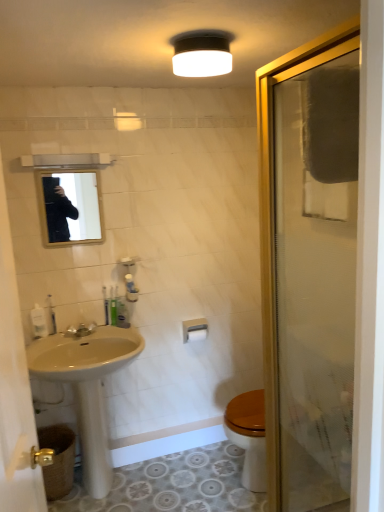
Question: Is white glossy mirror at upper left wider or thinner than white matte light fixture at upper center?

Choices:
 (A) wide
 (B) thin

Answer: (B)

Question: Is point (3, 309) closer or farther from the camera than point (195, 53)?

Choices:
 (A) closer
 (B) farther

Answer: (A)

Question: Which of these objects is positioned closest to the clear glass shower door at right?

Choices:
 (A) matte silver faucet at lower left
 (B) translucent plastic soap dispenser at lower left, the 1th toiletry positioned from the left
 (C) matte glass mirror at upper center
 (D) beige ceramic sink at left
 (E) green plastic toothbrush at lower left, acting as the first toiletry starting from the right

Answer: (D)

Question: Estimate the real-world distances between objects in this image. Which object is closer to the beige ceramic sink at left?

Choices:
 (A) green plastic toothbrush at lower left, acting as the first toiletry starting from the right
 (B) white glossy mirror at upper left
 (C) translucent plastic toothbrush at lower left, which is counted as the 2th toiletry, starting from the left
 (D) translucent plastic soap dispenser at lower left, which is the third toiletry from right to left
 (E) matte silver faucet at lower left

Answer: (E)